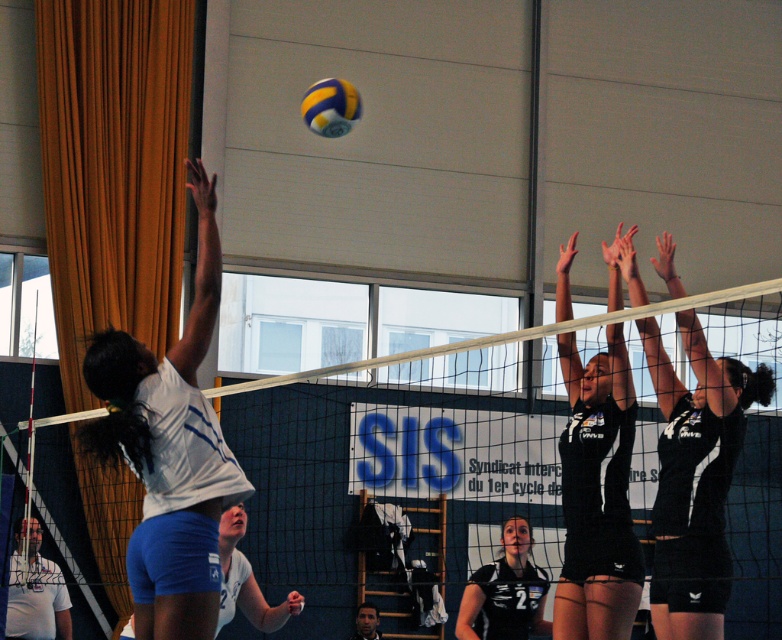
Question: Which of the following is the closest to the observer?

Choices:
 (A) black matte volleyball net at upper center
 (B) yellowmaterial/texturevolleyball at upper center
 (C) black jersey at center
 (D) black matte uniform at center

Answer: (A)

Question: Can you confirm if black matte volleyball net at upper center is positioned to the right of black matte uniform at center?

Choices:
 (A) no
 (B) yes

Answer: (B)

Question: Is white mesh net at center positioned behind yellowmaterial/texturevolleyball at upper center?

Choices:
 (A) no
 (B) yes

Answer: (A)

Question: Which point is closer to the camera taking this photo?

Choices:
 (A) (734, 380)
 (B) (504, 580)

Answer: (A)

Question: Which point is farther from the camera taking this photo?

Choices:
 (A) (615, 355)
 (B) (671, 307)
 (C) (711, 634)
 (D) (210, 465)

Answer: (A)

Question: Can you confirm if white matte/vinyl volleyball player at upper center is thinner than black matte volleyball net at upper center?

Choices:
 (A) no
 (B) yes

Answer: (B)